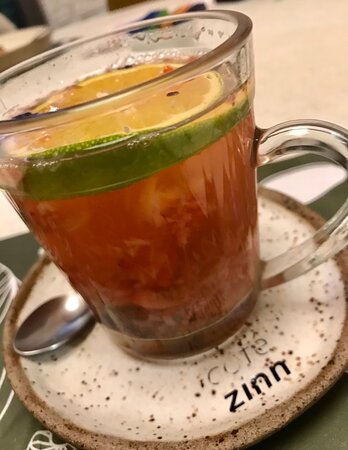
This screenshot has height=450, width=348. Find the location of `handle of mug`. handle of mug is located at coordinates (333, 247).